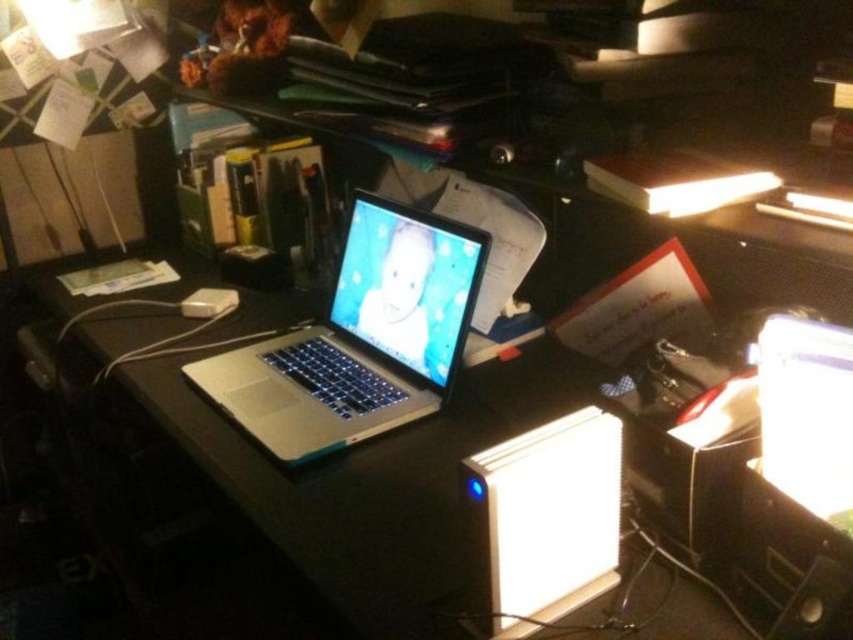
Can you confirm if silver metallic laptop at center is positioned above white plastic external hard drive at center?

Yes.

Is silver metallic laptop at center shorter than white plastic external hard drive at center?

No.

Between point (376, 269) and point (479, 548), which one is positioned in front?

Point (479, 548)

Where is `silver metallic laptop at center`? The width and height of the screenshot is (853, 640). silver metallic laptop at center is located at coordinates (358, 339).